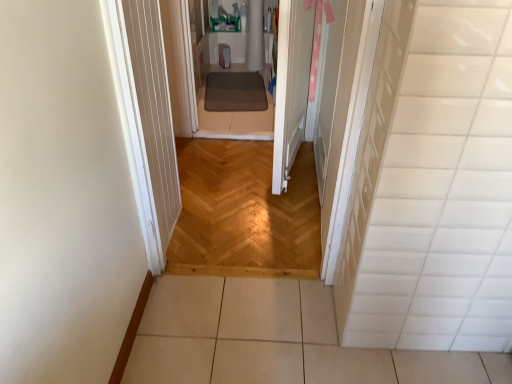
Locate an element on the screen. This screenshot has width=512, height=384. vacant space underneath brown textured mat at center (from a real-world perspective) is located at coordinates (234, 95).